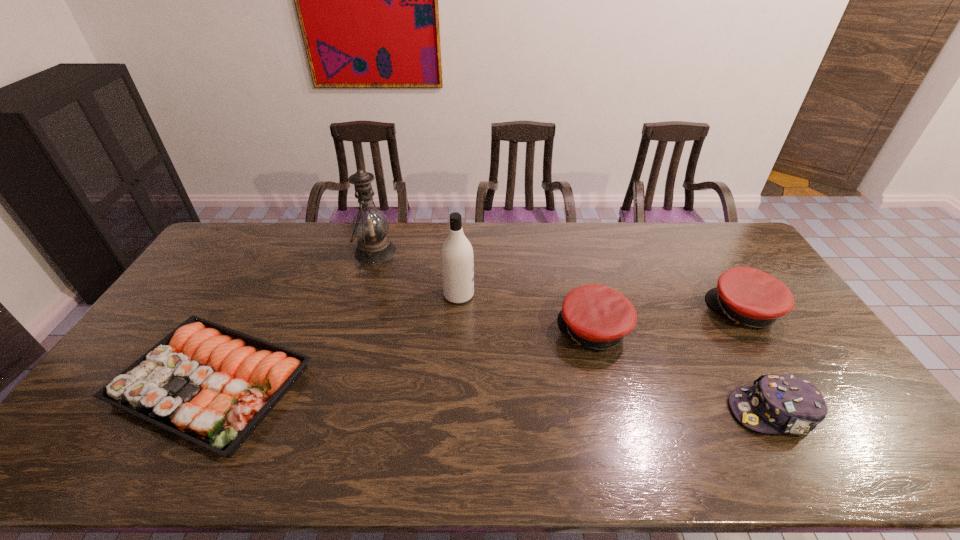
Find the location of a particular element. the farthest object is located at coordinates (370, 226).

The image size is (960, 540). I want to click on shampoo, so click(457, 259).

You are a GUI agent. You are given a task and a screenshot of the screen. Output one action in this format:
    pyautogui.click(x=<x>, y=<y>)
    Task: Click on the leftmost headwear
    The image size is (960, 540).
    Given the screenshot: What is the action you would take?
    pyautogui.click(x=595, y=316)

Identify the location of the nearest headwear. The height and width of the screenshot is (540, 960). (776, 403).

Locate an element on the screen. The height and width of the screenshot is (540, 960). the shortest object is located at coordinates (212, 385).

The width and height of the screenshot is (960, 540). Find the location of `free location located on the back of the oil lamp`. free location located on the back of the oil lamp is located at coordinates (383, 224).

The image size is (960, 540). What are the coordinates of `vacant space located 0.300m on the front-facing side of the shampoo` in the screenshot? It's located at (565, 295).

Where is `vacant space located 0.080m on the front-facing side of the leftmost headwear`? This screenshot has height=540, width=960. vacant space located 0.080m on the front-facing side of the leftmost headwear is located at coordinates (532, 331).

What are the coordinates of `vacant space positioned on the front-facing side of the leftmost headwear` in the screenshot? It's located at (518, 331).

Find the location of a particular element. This screenshot has width=960, height=540. vacant region located on the front-facing side of the leftmost headwear is located at coordinates (475, 331).